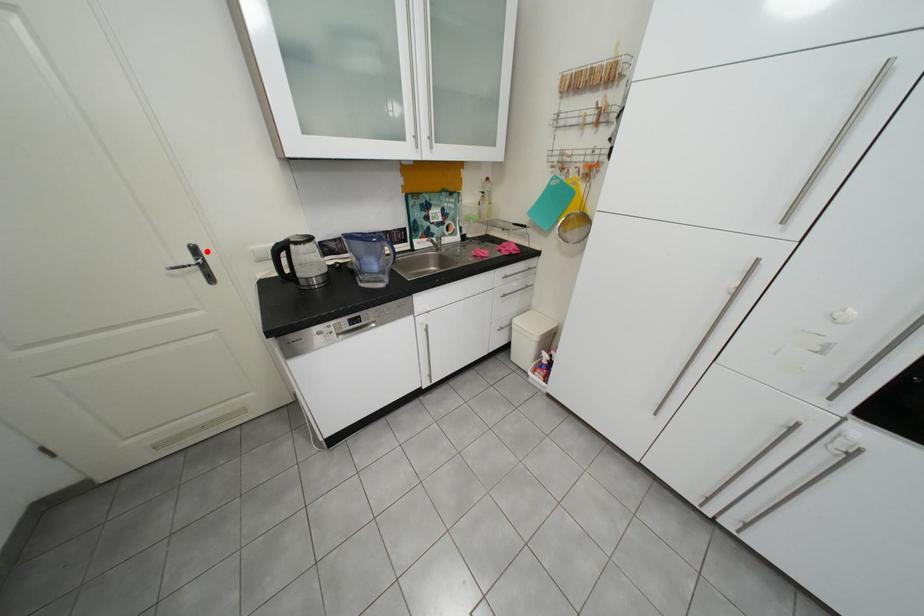
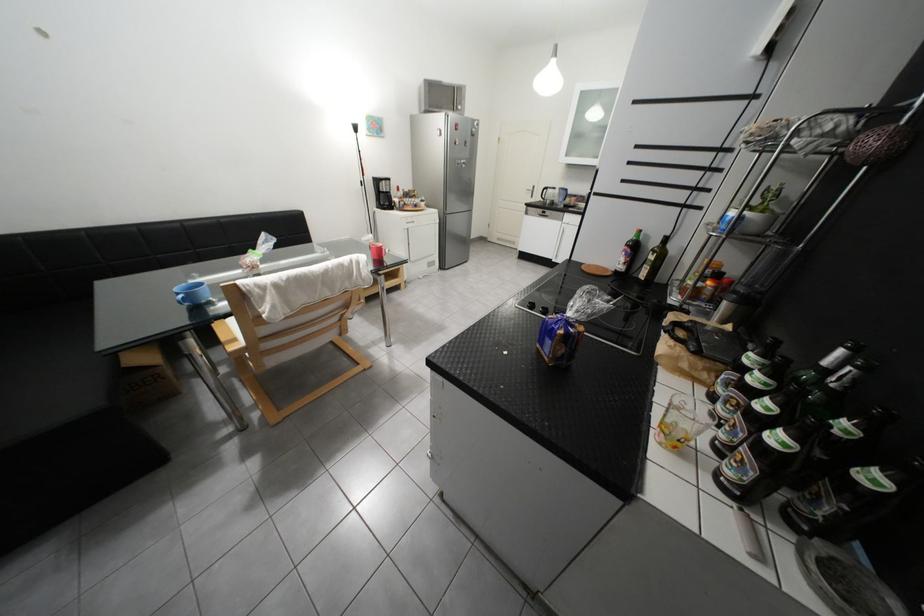
In the second image, find the point that corresponds to the highlighted location in the first image.

(545, 188)